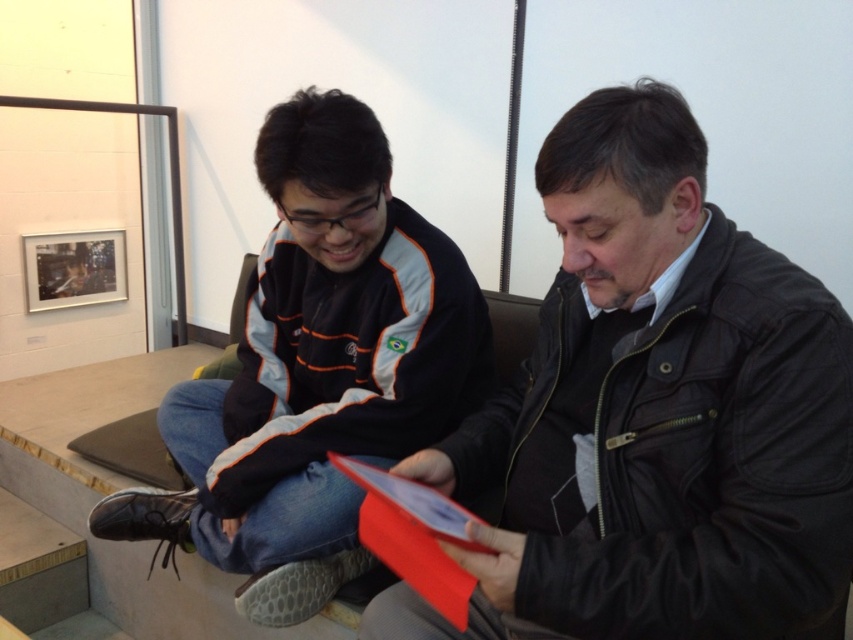
You are standing in the gallery and want to take a photo of the leather jacket at center. According to the coordinates provided, where exactly should you aim your camera?

The leather jacket at center is located at coordinates point (654, 417), so aim your camera there to capture it.

Based on the scene description, where is the leather jacket at center located in terms of coordinates?

The leather jacket at center is located at point coordinates of (x=654, y=417).

You are an artist in the gallery who needs to place a new sculpture between the matte black jacket at center and the leather textured shoe at lower left. Based on their positions, which object should the sculpture be closer to?

The sculpture should be closer to the leather textured shoe at lower left because the matte black jacket at center is positioned over it, meaning the shoe is lower in the scene.